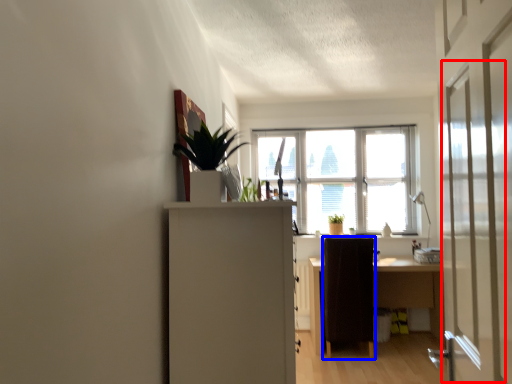
Question: Which point is further to the camera, screen door (highlighted by a red box) or furniture (highlighted by a blue box)?

Choices:
 (A) screen door
 (B) furniture

Answer: (B)